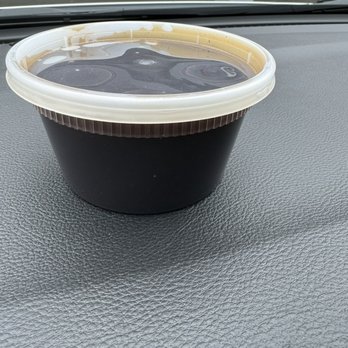
Identify the location of plastic cup. The width and height of the screenshot is (348, 348). (173, 182).